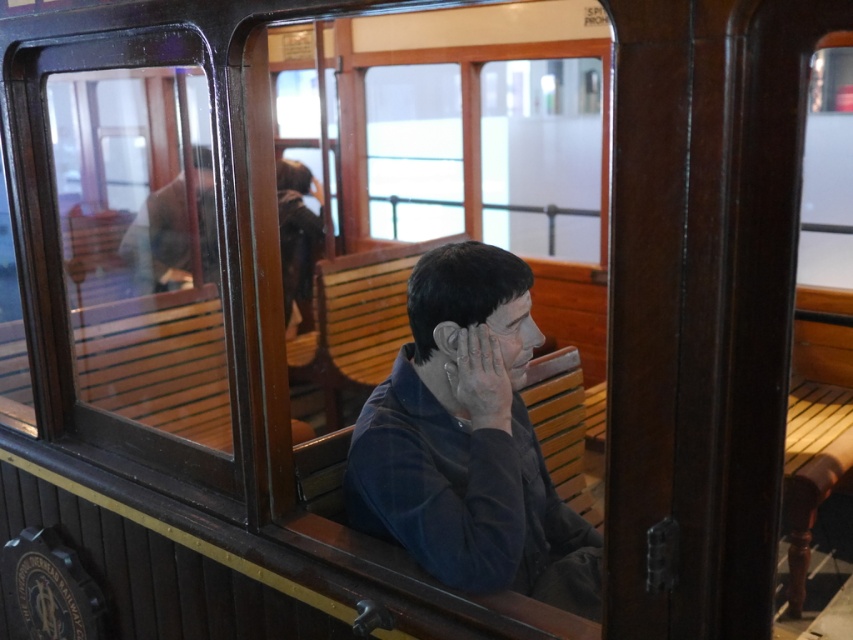
You are a visitor in the vintage tram car and notice two objects at the center of the scene. Which object is closer to you, the matte gray hand at center or the matte black face at center?

The matte gray hand at center is closer to you because it is in front of the matte black face at center.